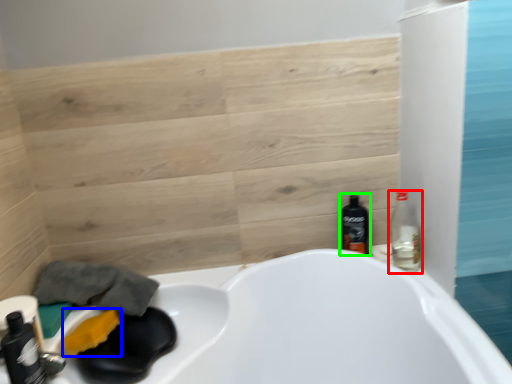
Question: Considering the real-world distances, which object is farthest from bottle (highlighted by a red box)? soap (highlighted by a blue box) or bottle (highlighted by a green box)?

Choices:
 (A) soap
 (B) bottle

Answer: (A)